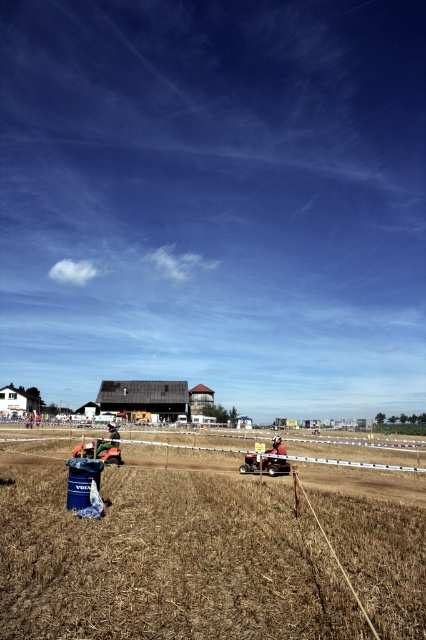
Does brown dry grass at center appear on the right side of metallic silver motorcycle at center?

Yes, brown dry grass at center is to the right of metallic silver motorcycle at center.

Is brown dry grass at center smaller than metallic silver motorcycle at center?

Yes, brown dry grass at center is smaller than metallic silver motorcycle at center.

Does point (103, 604) come closer to viewer compared to point (109, 428)?

Yes.

Where is `brown dry grass at center`? The width and height of the screenshot is (426, 640). brown dry grass at center is located at coordinates (164, 554).

Between metallic red plow at center and metallic silver motorcycle at center, which one is positioned higher?

metallic red plow at center is above.

Between point (256, 468) and point (112, 435), which one is positioned in front?

Point (256, 468) is more forward.

Between point (259, 468) and point (111, 445), which one is positioned behind?

Positioned behind is point (111, 445).

Image resolution: width=426 pixels, height=640 pixels. I want to click on metallic red plow at center, so click(x=264, y=465).

Who is lower down, brown dry grass at center or metallic red plow at center?

brown dry grass at center

Is brown dry grass at center above metallic red plow at center?

Incorrect, brown dry grass at center is not positioned above metallic red plow at center.

Who is more forward, (402, 534) or (242, 468)?

Point (402, 534)

Where is `brown dry grass at center`? Image resolution: width=426 pixels, height=640 pixels. brown dry grass at center is located at coordinates (164, 554).